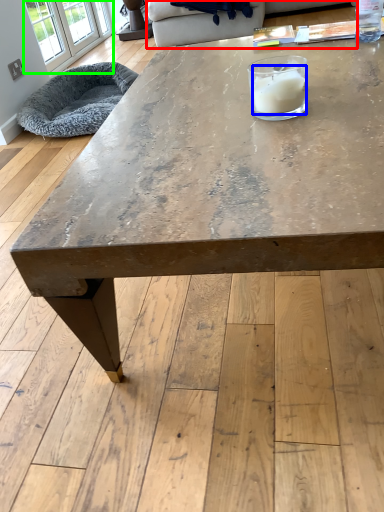
Question: Which object is positioned closest to couch (highlighted by a red box)? Select from candle (highlighted by a blue box) and window (highlighted by a green box).

Choices:
 (A) candle
 (B) window

Answer: (B)